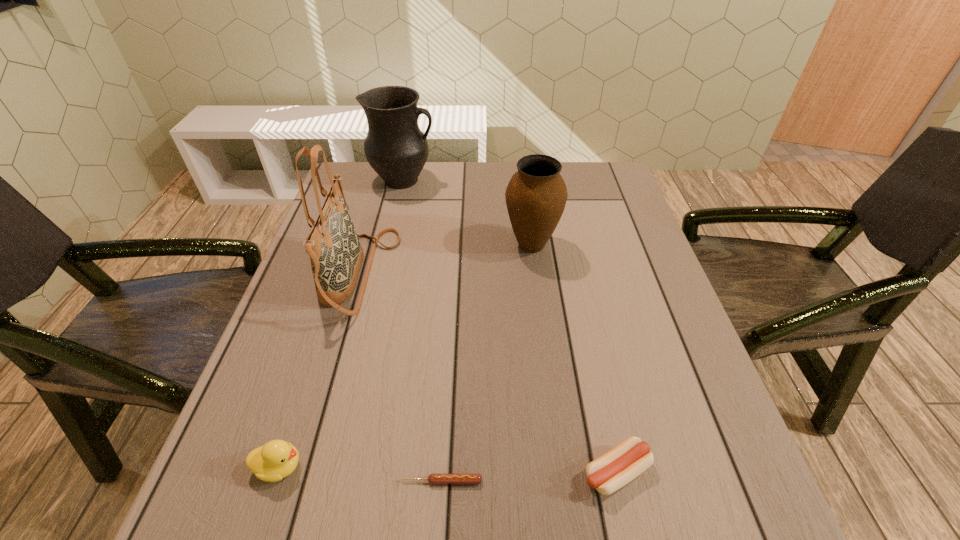
This screenshot has height=540, width=960. In order to click on vacant position in the image that satisfies the following two spatial constraints: 1. on the beak of the duckling; 2. on the left side of the left sausage in this screenshot , I will do `click(275, 481)`.

This screenshot has height=540, width=960. Find the location of `vacant space that satisfies the following two spatial constraints: 1. on the handle side of the farthest object; 2. on the left side of the urn`. vacant space that satisfies the following two spatial constraints: 1. on the handle side of the farthest object; 2. on the left side of the urn is located at coordinates (389, 245).

This screenshot has height=540, width=960. Identify the location of vacant region that satisfies the following two spatial constraints: 1. on the handle side of the shorter sausage; 2. on the right side of the farthest object. (334, 481).

This screenshot has height=540, width=960. In order to click on blank area in the image that satisfies the following two spatial constraints: 1. on the back side of the second shortest object; 2. on the front-facing side of the tallest object in this screenshot , I will do `click(572, 274)`.

At what (x,y) coordinates should I click in order to perform the action: click on vacant space that satisfies the following two spatial constraints: 1. on the handle side of the pitcher; 2. on the left side of the taller sausage. Please return your answer as a coordinate pair (x, y). Looking at the image, I should click on (336, 472).

You are a GUI agent. You are given a task and a screenshot of the screen. Output one action in this format:
    pyautogui.click(x=<x>, y=<y>)
    Task: Click on the vacant space that satisfies the following two spatial constraints: 1. on the front side of the urn; 2. on the right side of the right sausage
    Image resolution: width=960 pixels, height=540 pixels.
    Given the screenshot: What is the action you would take?
    pyautogui.click(x=561, y=472)

Find the location of `vacant region that satisfies the following two spatial constraints: 1. on the front-facing side of the handbag; 2. on the back side of the shorter sausage`. vacant region that satisfies the following two spatial constraints: 1. on the front-facing side of the handbag; 2. on the back side of the shorter sausage is located at coordinates (300, 481).